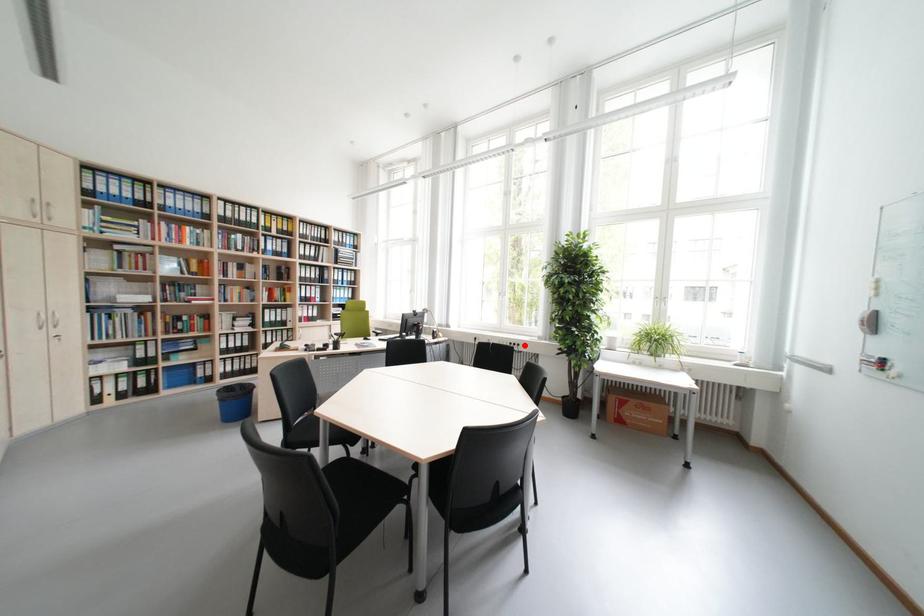
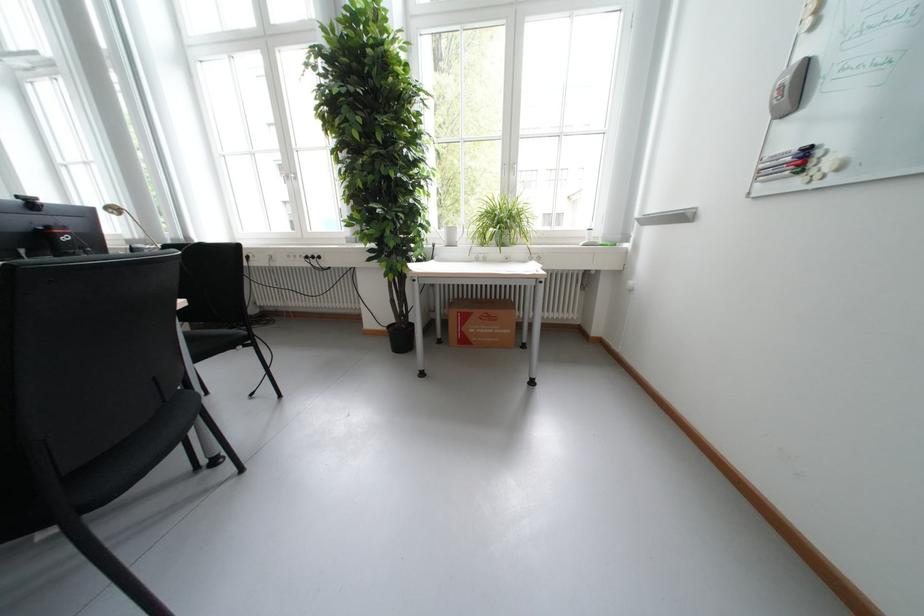
Question: I am providing you with two images of the same scene from different viewpoints. Image1 has a red point marked. In image2, the corresponding 3D location appears at what relative position? Reply with the corresponding letter.

Choices:
 (A) Closer
 (B) Farther

Answer: (A)